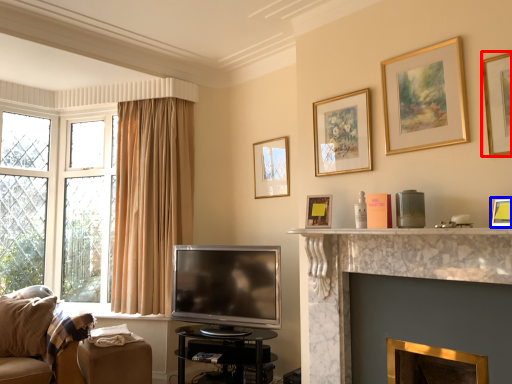
Question: Among these objects, which one is nearest to the camera, picture frame (highlighted by a red box) or picture frame (highlighted by a blue box)?

Choices:
 (A) picture frame
 (B) picture frame

Answer: (B)